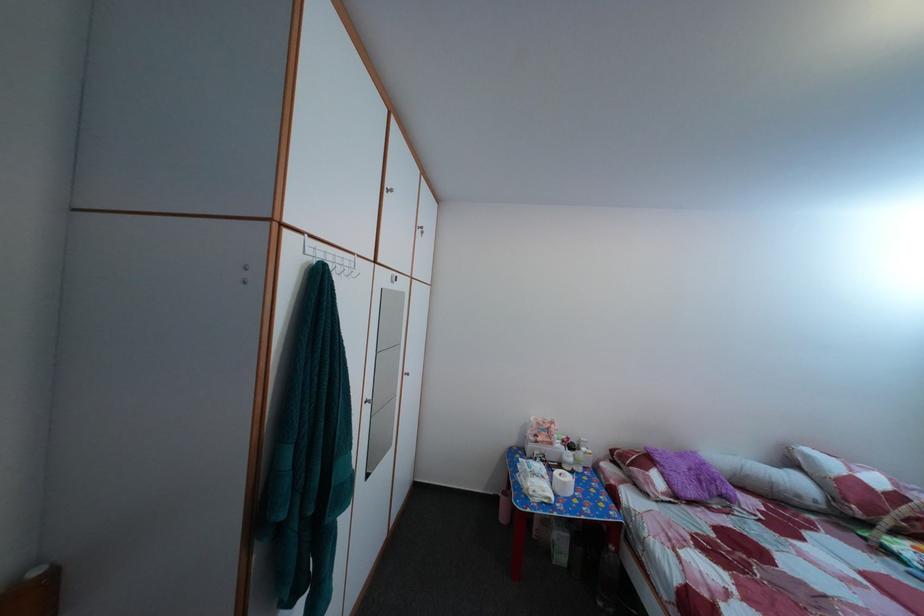
Which object does [859,488] point to?

It corresponds to the white and red pillow in the image.